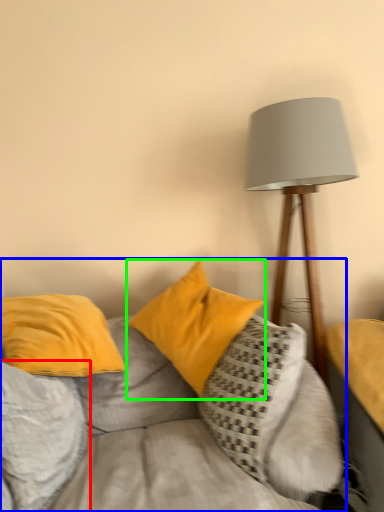
Question: Considering the real-world distances, which object is closest to pillow (highlighted by a red box)? studio couch (highlighted by a blue box) or pillow (highlighted by a green box).

Choices:
 (A) studio couch
 (B) pillow

Answer: (A)